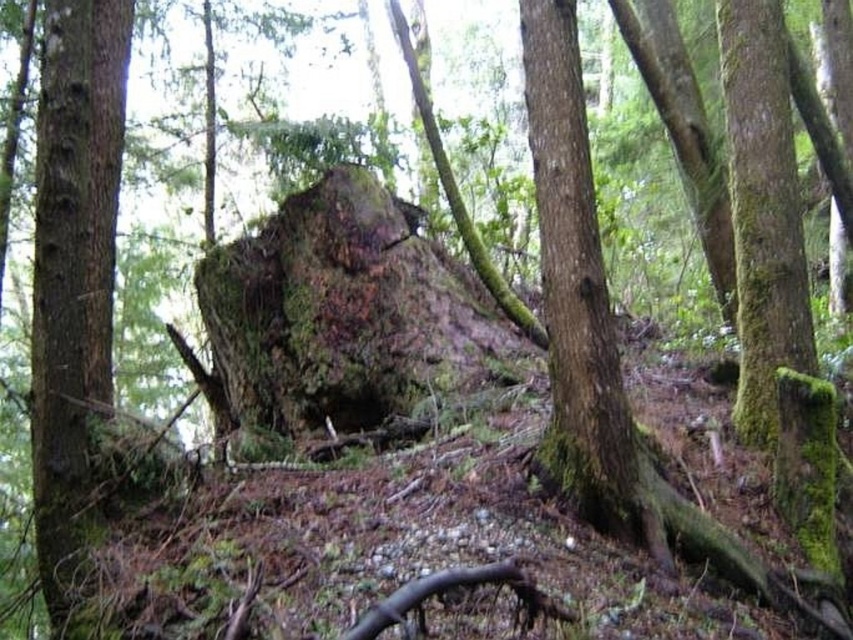
Question: Is the position of green mossy rock at center less distant than that of green mossy tree trunk at right?

Choices:
 (A) yes
 (B) no

Answer: (B)

Question: Which object is farther from the camera taking this photo?

Choices:
 (A) green mossy tree trunk at center
 (B) green mossy tree trunk at right
 (C) green mossy rock at center

Answer: (C)

Question: Considering the relative positions of green mossy rock at center and green mossy tree trunk at center in the image provided, where is green mossy rock at center located with respect to green mossy tree trunk at center?

Choices:
 (A) left
 (B) right

Answer: (B)

Question: Is green mossy rock at center positioned behind green mossy tree trunk at right?

Choices:
 (A) no
 (B) yes

Answer: (B)

Question: Which point appears closest to the camera in this image?

Choices:
 (A) (798, 228)
 (B) (38, 413)

Answer: (B)

Question: Which point is closer to the camera taking this photo?

Choices:
 (A) (462, 326)
 (B) (717, 8)
 (C) (74, 397)

Answer: (C)